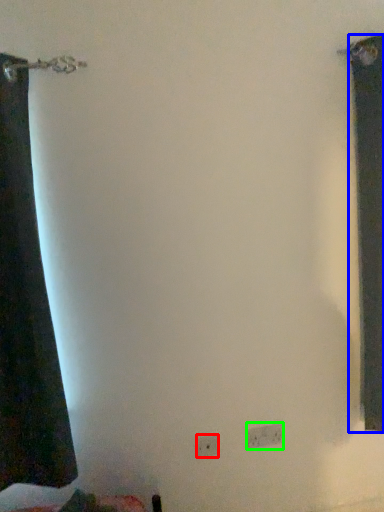
Question: Considering the real-world distances, which object is closest to electric outlet (highlighted by a red box)? curtain (highlighted by a blue box) or electric outlet (highlighted by a green box).

Choices:
 (A) curtain
 (B) electric outlet

Answer: (B)